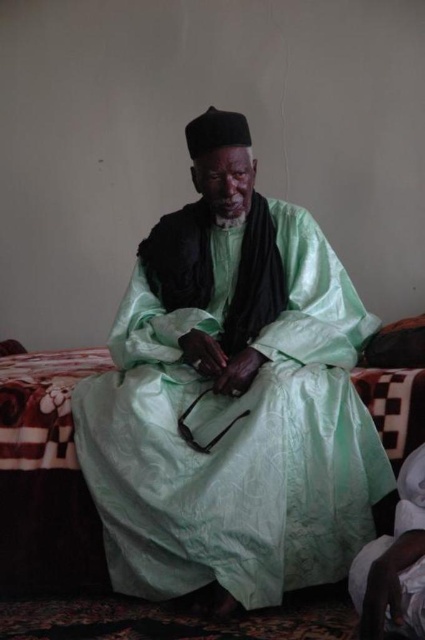
You are a photographer trying to capture the elderly man in the scene. Since you want to focus on his clothing details, which object should you adjust your camera focus on first, the matte green silk robe at center or the patterned fabric bed at center?

The matte green silk robe at center is closer to the viewer than the patterned fabric bed at center, so you should focus on the matte green silk robe at center first to ensure sharp details.

Looking at this image, you are a photographer setting up a shoot in this room. You need to position a light source to the left of the patterned fabric bed at center. Will the light source also be to the left of the matte green silk robe at center?

The matte green silk robe at center is to the right of the patterned fabric bed at center, so placing the light source to the left of the patterned fabric bed at center would also place it to the left of the matte green silk robe at center.

You need to determine which item is on top in the scene. Which one is above the other between the matte green silk robe at center and the patterned fabric bed at center?

The matte green silk robe at center is positioned over the patterned fabric bed at center, so the matte green silk robe at center is above the patterned fabric bed at center.